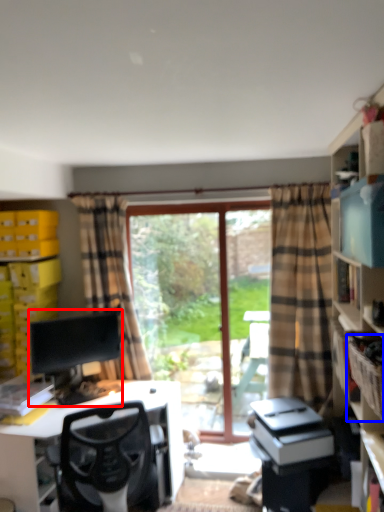
Question: Which object appears closest to the camera in this image, computer monitor (highlighted by a red box) or crate (highlighted by a blue box)?

Choices:
 (A) computer monitor
 (B) crate

Answer: (B)